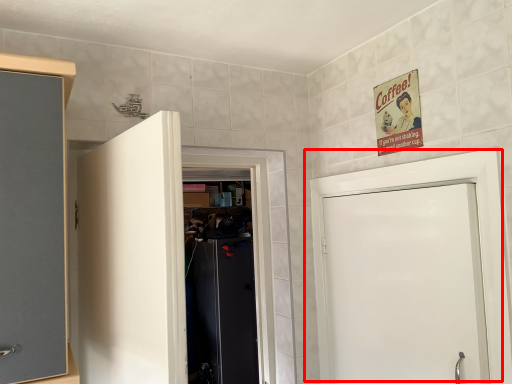
Question: From the image's perspective, considering the relative positions of door (annotated by the red box) and door in the image provided, where is door (annotated by the red box) located with respect to the staircase?

Choices:
 (A) below
 (B) above

Answer: (A)